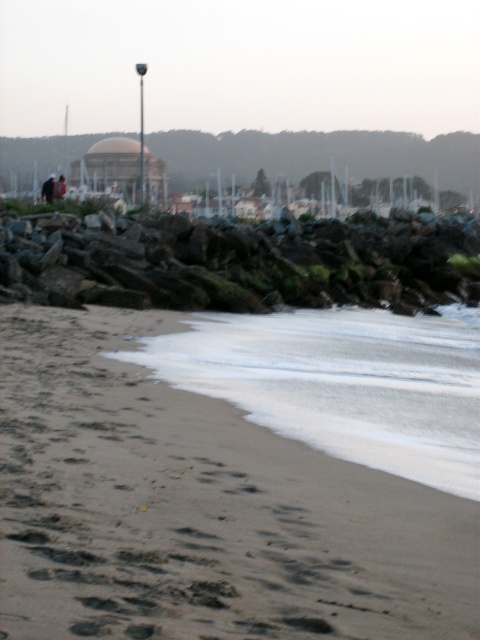
You are a photographer standing on the beach and want to capture both the white foam water at lower center and the dark brown leather jacket at center in the same frame. Based on their positions, which object should you adjust your camera angle to include first?

The white foam water at lower center is positioned on the right side of dark brown leather jacket at center. To include both in the frame, adjust your camera angle to first ensure the white foam water at lower center is visible on the right side of the dark brown leather jacket at center.

You are standing on the beach and want to walk from the sandy brown at lower left to the white foam water at lower center. Which path would require stepping on more water?

The path to the white foam water at lower center requires stepping on more water because it is wider than the sandy brown at lower left.

You are standing on the beach and want to walk from the sandy brown at lower left to the dark gray rough rocks at center. Which direction should you move to reach them?

You should move to the right because the dark gray rough rocks at center are positioned to the right of the sandy brown at lower left.